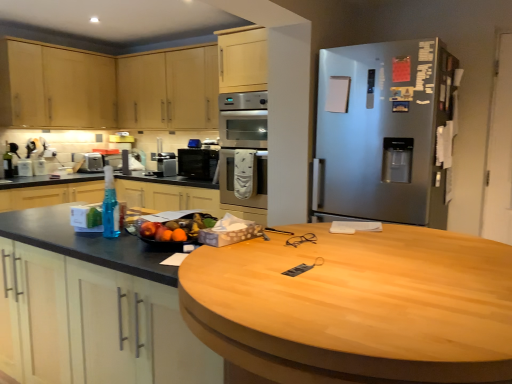
Question: Can you confirm if matte black countertop at left is smaller than satin silver toaster at left, positioned as the 2th appliance in front-to-back order?

Choices:
 (A) no
 (B) yes

Answer: (A)

Question: Is matte black countertop at left not inside satin silver toaster at left, the 1th appliance from the left?

Choices:
 (A) no
 (B) yes

Answer: (B)

Question: Is the position of matte black countertop at left more distant than that of satin silver toaster at left, positioned as the second appliance in right-to-left order?

Choices:
 (A) no
 (B) yes

Answer: (A)

Question: Can you confirm if matte black countertop at left is shorter than satin silver toaster at left, positioned as the 2th appliance in front-to-back order?

Choices:
 (A) yes
 (B) no

Answer: (B)

Question: Is matte black countertop at left looking in the opposite direction of satin silver toaster at left, positioned as the second appliance in right-to-left order?

Choices:
 (A) yes
 (B) no

Answer: (A)

Question: In the image, is satin silver oven at center positioned in front of or behind satin black coffee maker at center, acting as the first appliance starting from the right?

Choices:
 (A) front
 (B) behind

Answer: (A)

Question: From a real-world perspective, is satin silver oven at center physically located above or below satin black coffee maker at center, acting as the first appliance starting from the front?

Choices:
 (A) above
 (B) below

Answer: (A)

Question: Do you think satin silver oven at center is within satin black coffee maker at center, acting as the first appliance starting from the front, or outside of it?

Choices:
 (A) outside
 (B) inside

Answer: (A)

Question: Considering the positions of satin silver oven at center and satin black coffee maker at center, acting as the first appliance starting from the right, in the image, is satin silver oven at center taller or shorter than satin black coffee maker at center, acting as the first appliance starting from the right,?

Choices:
 (A) tall
 (B) short

Answer: (A)

Question: Is satin black coffee maker at center, acting as the first appliance starting from the front, taller or shorter than satin silver refrigerator at right?

Choices:
 (A) tall
 (B) short

Answer: (B)

Question: Considering the relative positions of satin black coffee maker at center, acting as the first appliance starting from the front, and satin silver refrigerator at right in the image provided, is satin black coffee maker at center, acting as the first appliance starting from the front, to the left or to the right of satin silver refrigerator at right?

Choices:
 (A) left
 (B) right

Answer: (A)

Question: From a real-world perspective, is satin black coffee maker at center, acting as the first appliance starting from the front, physically located above or below satin silver refrigerator at right?

Choices:
 (A) above
 (B) below

Answer: (B)

Question: Choose the correct answer: Is satin black coffee maker at center, acting as the first appliance starting from the right, inside satin silver refrigerator at right or outside it?

Choices:
 (A) outside
 (B) inside

Answer: (A)

Question: Is point (415, 170) positioned closer to the camera than point (86, 155)?

Choices:
 (A) closer
 (B) farther

Answer: (A)

Question: In the image, is satin silver refrigerator at right on the left side or the right side of satin silver toaster at left, the first appliance from the back?

Choices:
 (A) right
 (B) left

Answer: (A)